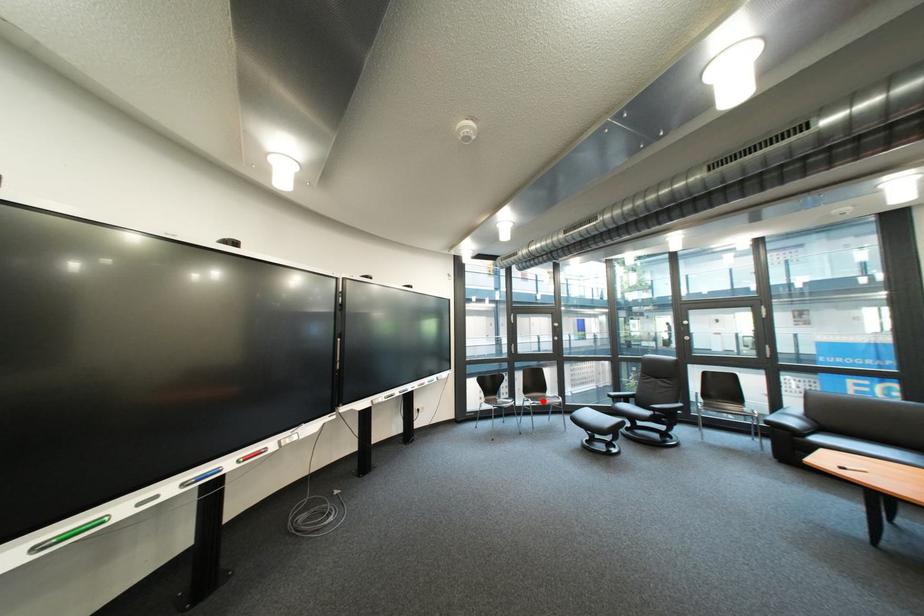
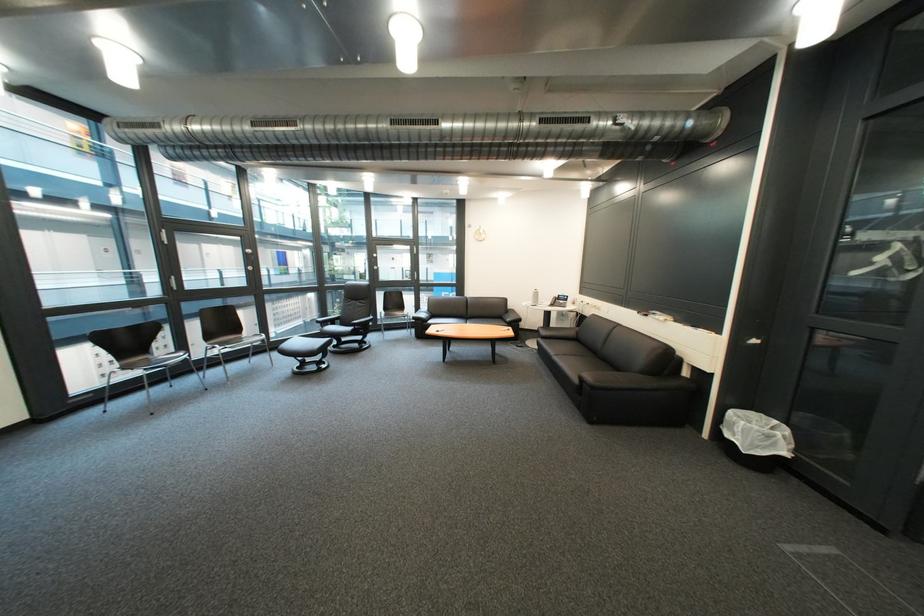
Locate, in the second image, the point that corresponds to the highlighted location in the first image.

(229, 347)